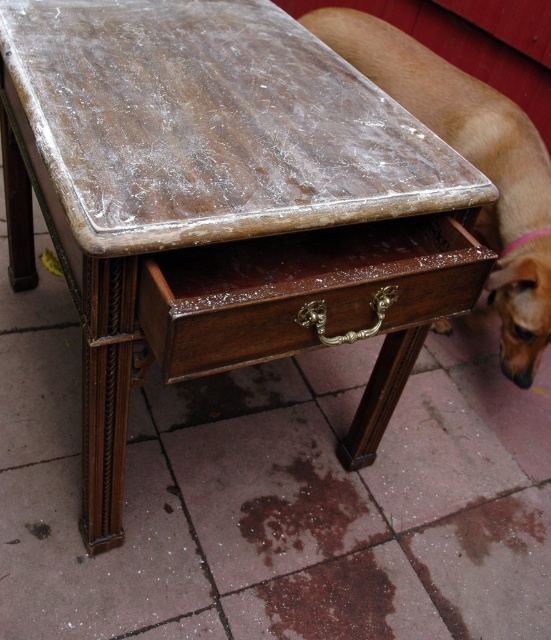
Question: Is shiny brown wood drawer at center to the left of brown fur dog at lower right from the viewer's perspective?

Choices:
 (A) no
 (B) yes

Answer: (B)

Question: Does shiny brown wood drawer at center have a lesser width compared to brown fur dog at lower right?

Choices:
 (A) no
 (B) yes

Answer: (B)

Question: Which object appears closest to the camera in this image?

Choices:
 (A) brown fur dog at lower right
 (B) shiny brown wood drawer at center

Answer: (B)

Question: Is shiny brown wood drawer at center to the left of brown fur dog at lower right from the viewer's perspective?

Choices:
 (A) no
 (B) yes

Answer: (B)